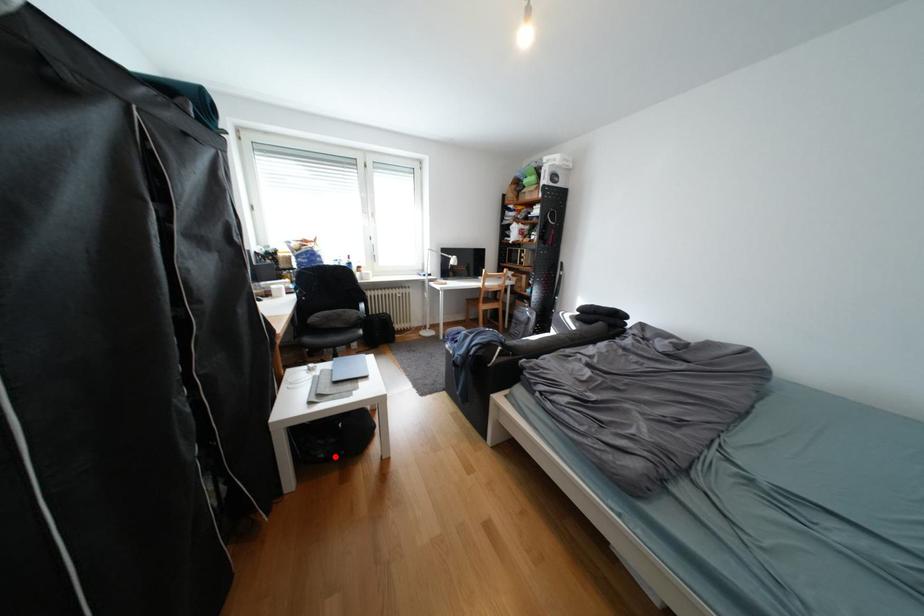
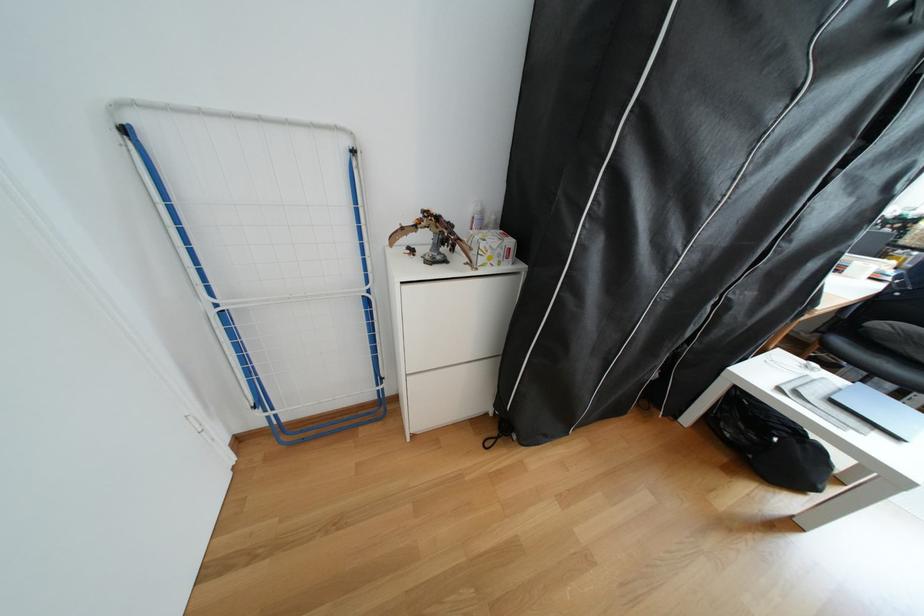
Question: I am providing you with two images of the same scene from different viewpoints. A red point is shown in image1. For the corresponding object point in image2, is it positioned nearer or farther from the camera?

Choices:
 (A) Nearer
 (B) Farther

Answer: (A)